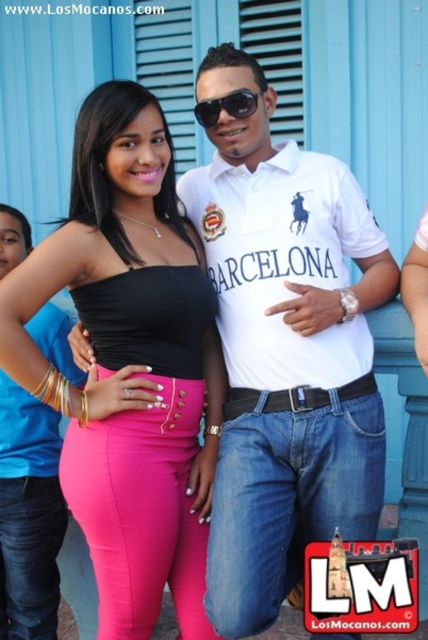
You are a photographer trying to capture a closeup of the sunglasses at center and the pink matte leggings at center in the image. Which object should you focus on first if you want to ensure both are in focus without adjusting the camera settings?

The pink matte leggings at center is much taller than the sunglasses at center, so focusing on the pink matte leggings at center first will help ensure both are in focus since it is farther away and has a larger depth of field.

You are a photographer trying to adjust the composition of this photo. The two subjects are currently positioned such that the pink matte leggings at center and the sunglasses at center are 1.60 meters apart. To create a more dynamic shot, you want to reduce the distance between them to 1.20 meters without moving the subjects themselves. What adjustment could you make to the camera to achieve this?

You can zoom in on the subjects using the camera lens. Zooming in reduces the apparent distance between the pink matte leggings at center and the sunglasses at center, bringing them closer together in the frame to achieve the desired 1.20 meters separation.

You are standing in front of the photo and want to touch the pink matte leggings at lower left and the sunglasses at center. Which object is nearer to your hand when you reach out?

The pink matte leggings at lower left is closer to the viewer than sunglasses at center, so you can touch the pink matte leggings at lower left first.